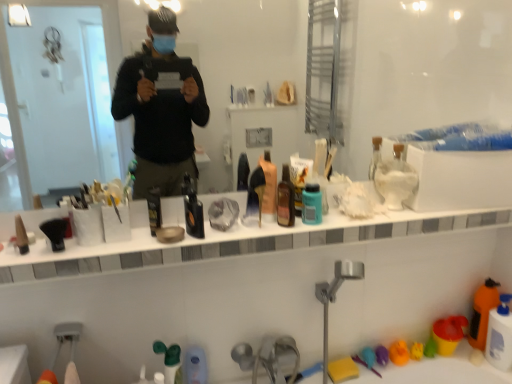
This screenshot has height=384, width=512. I want to click on vacant area that lies to the right of black matte bottle at center, so click(x=239, y=233).